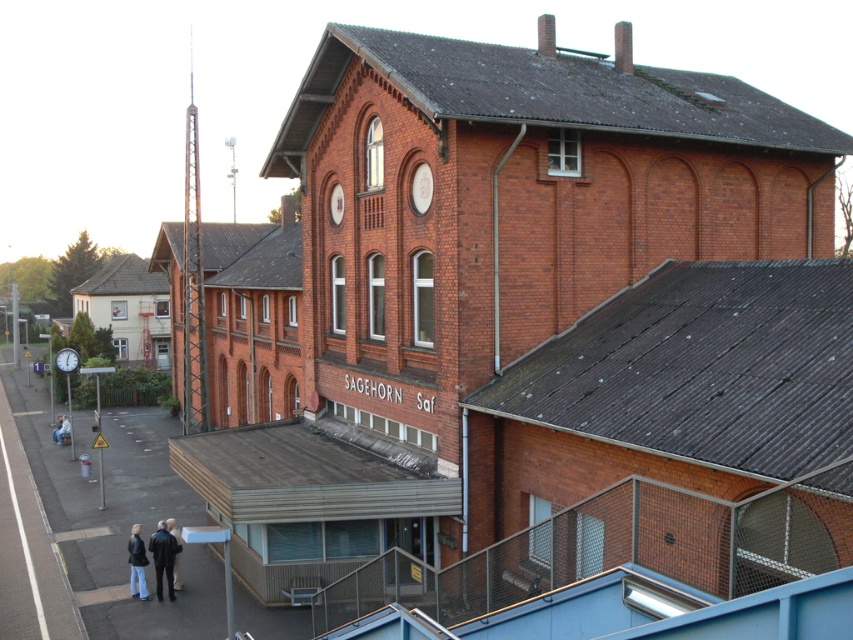
Who is positioned more to the right, dark gray jacket at lower center or metallic round clock at upper left?

dark gray jacket at lower center is more to the right.

Can you confirm if dark gray jacket at lower center is positioned below metallic round clock at upper left?

Indeed, dark gray jacket at lower center is positioned under metallic round clock at upper left.

The width and height of the screenshot is (853, 640). I want to click on dark gray jacket at lower center, so click(177, 552).

Where is `dark gray jacket at lower center`? The image size is (853, 640). dark gray jacket at lower center is located at coordinates (177, 552).

Who is taller, dark blue jacket at lower center or dark gray jacket at lower center?

dark blue jacket at lower center is taller.

Based on the photo, which is below, dark blue jacket at lower center or dark gray jacket at lower center?

Positioned lower is dark blue jacket at lower center.

This screenshot has width=853, height=640. What are the coordinates of `dark blue jacket at lower center` in the screenshot? It's located at (163, 557).

The width and height of the screenshot is (853, 640). I want to click on dark blue jacket at lower center, so click(x=163, y=557).

Can you confirm if metallic round clock at upper left is smaller than denim jacket at lower left?

Indeed, metallic round clock at upper left has a smaller size compared to denim jacket at lower left.

Is point (78, 364) farther from viewer compared to point (54, 440)?

Yes, it is behind point (54, 440).

Is point (77, 355) in front of point (51, 432)?

That is False.

Identify the location of metallic round clock at upper left. (67, 358).